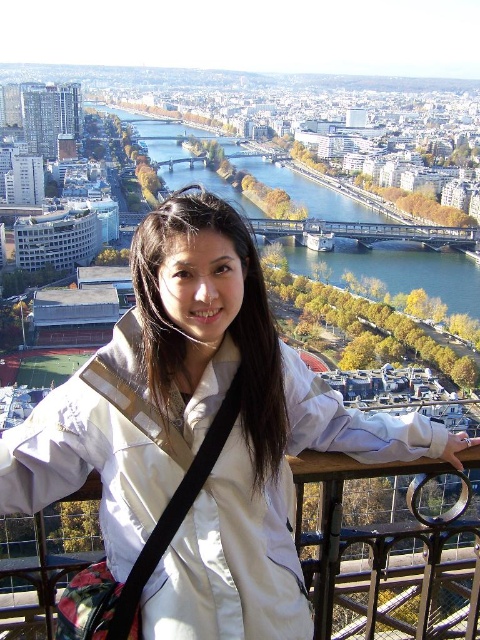
Question: Is white fabric jacket at center below green water at center?

Choices:
 (A) no
 (B) yes

Answer: (B)

Question: Which point appears farthest from the camera in this image?

Choices:
 (A) (355, 214)
 (B) (115, 500)

Answer: (A)

Question: Is white fabric jacket at center above green water at center?

Choices:
 (A) no
 (B) yes

Answer: (A)

Question: Which object appears closest to the camera in this image?

Choices:
 (A) green water at center
 (B) white fabric jacket at center

Answer: (B)

Question: Is white fabric jacket at center in front of green water at center?

Choices:
 (A) yes
 (B) no

Answer: (A)